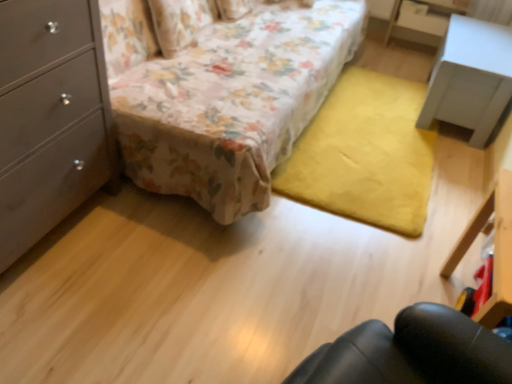
The height and width of the screenshot is (384, 512). I want to click on free space to the left of white matte nightstand at upper right, so click(x=380, y=99).